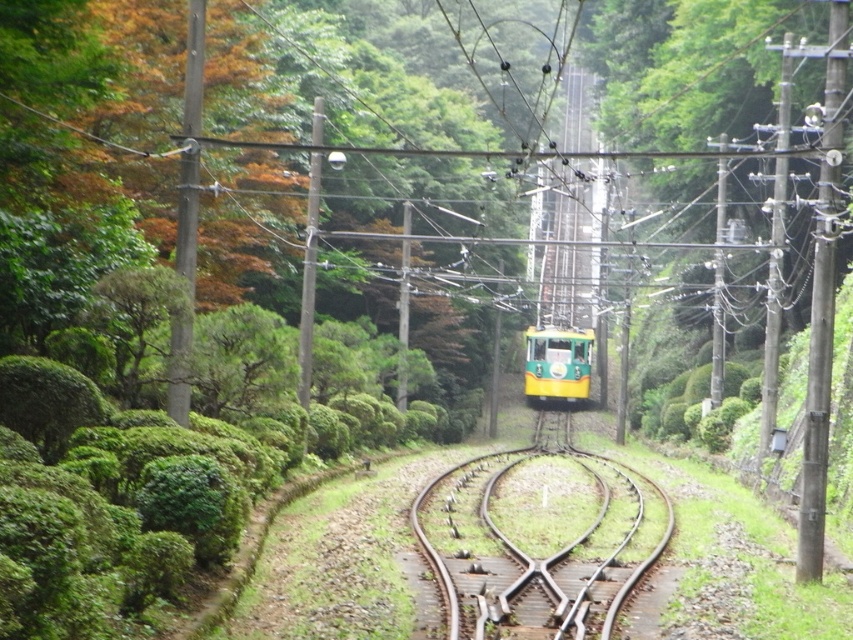
Does brown wooden train track at center have a lesser height compared to green matte train at center?

Yes.

Can you confirm if brown wooden train track at center is taller than green matte train at center?

No.

Who is more distant from viewer, (631,536) or (537,330)?

The point (537,330) is more distant.

The width and height of the screenshot is (853, 640). What are the coordinates of `brown wooden train track at center` in the screenshot? It's located at [x=538, y=540].